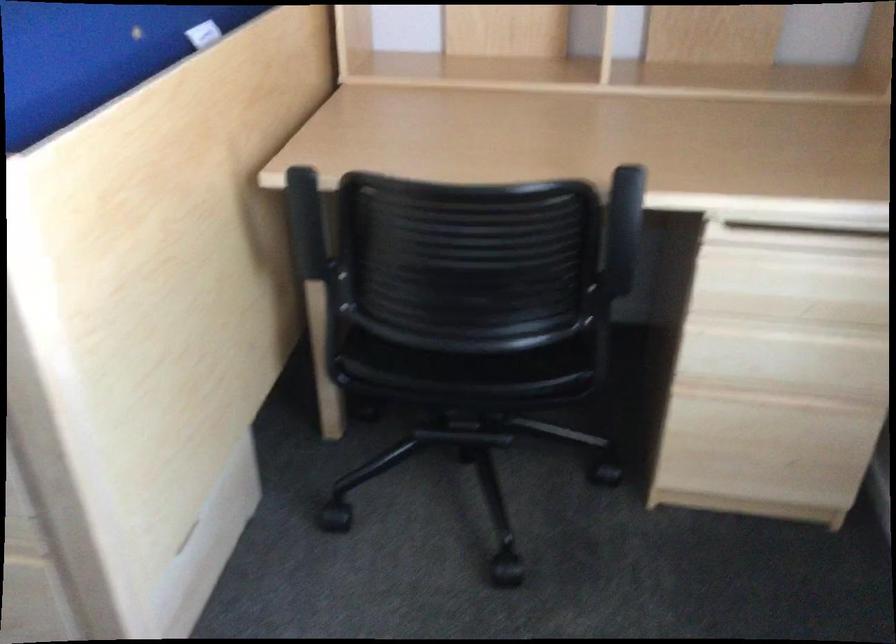
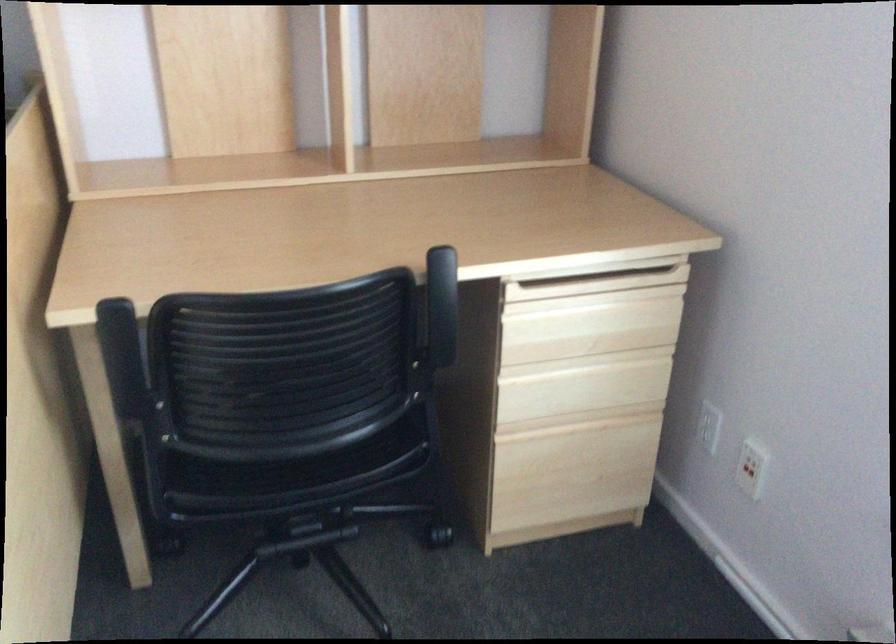
Question: I am providing you with two images of the same scene from different viewpoints. After the viewpoint changes to image2, which objects are now occluded?

Choices:
 (A) chair sitting surface
 (B) drawer handle lip
 (C) red switch button
 (D) none of these

Answer: (D)